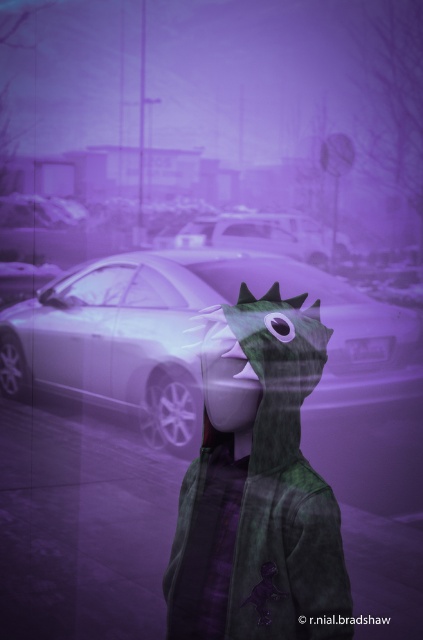
You are a photographer trying to capture the shiny silver car at center and the green matte dragon mask at center in the same frame. Based on their positions, which object should you adjust your camera to focus on first to ensure both are in the frame?

The green matte dragon mask at center is to the right of the shiny silver car at center, so you should focus on the shiny silver car at center first to ensure both are in the frame.

From the picture: You are a photographer trying to capture both the green matte dragon mask at center and the shiny silver car at center in a single frame. Since the dragon mask is smaller, where should you position your camera to ensure both objects are clearly visible in the photo?

To ensure both the green matte dragon mask at center and the shiny silver car at center are clearly visible, position the camera so that the shiny silver car at center is in the background and the smaller green matte dragon mask at center is placed closer to the camera. This way, the size difference will be balanced, allowing both to be visible in the frame.

You are trying to locate the green matte dragon mask at center in the parking lot scene. According to the coordinates provided, where exactly is it positioned?

The green matte dragon mask at center is located at point (257, 486), which means it is positioned towards the lower right area of the image.